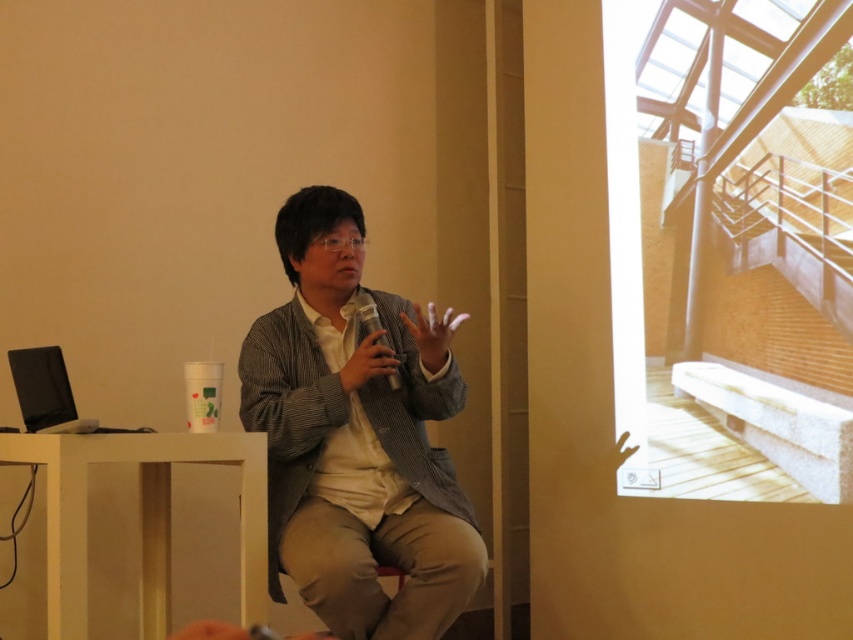
Which of these two, gray textured blazer at center or matte gray hand at center, stands taller?

With more height is gray textured blazer at center.

Consider the image. Which of these two, gray textured blazer at center or matte gray hand at center, stands shorter?

matte gray hand at center

Find the location of `gray textured blazer at center`. gray textured blazer at center is located at coordinates (352, 444).

Is point (450, 326) positioned before point (386, 358)?

Yes, it is.

Does matte gray hand at center appear on the right side of metallic silver cup at center?

Correct, you'll find matte gray hand at center to the right of metallic silver cup at center.

Which is behind, point (416, 337) or point (340, 380)?

Positioned behind is point (340, 380).

Where is `matte gray hand at center`? matte gray hand at center is located at coordinates 432,333.

Who is positioned more to the left, gray textured blazer at center or metallic silver cup at center?

gray textured blazer at center is more to the left.

Between point (380, 417) and point (398, 364), which one is positioned behind?

The point (380, 417) is behind.

I want to click on gray textured blazer at center, so click(352, 444).